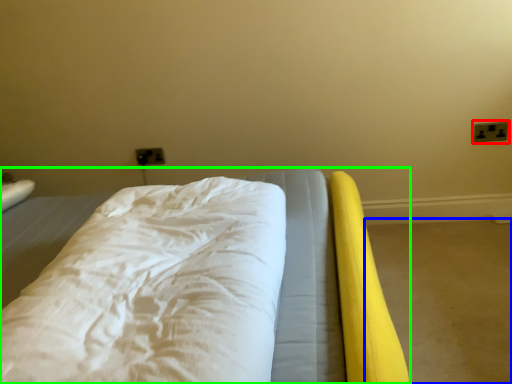
Question: Based on their relative distances, which object is nearer to electric outlet (highlighted by a red box)? Choose from concrete (highlighted by a blue box) and bed (highlighted by a green box).

Choices:
 (A) concrete
 (B) bed

Answer: (A)